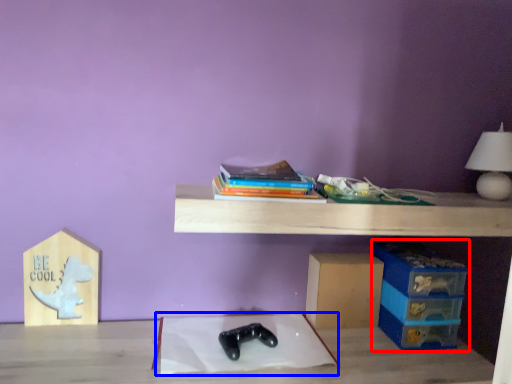
Question: Which object appears closest to the camera in this image, storage box (highlighted by a red box) or sheet (highlighted by a blue box)?

Choices:
 (A) storage box
 (B) sheet

Answer: (B)